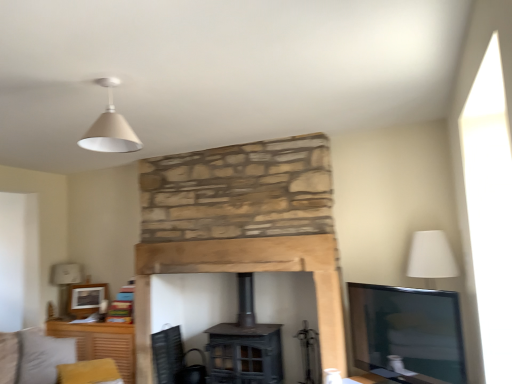
Image resolution: width=512 pixels, height=384 pixels. I want to click on free location above matte white cone at upper center (from a real-world perspective), so click(109, 82).